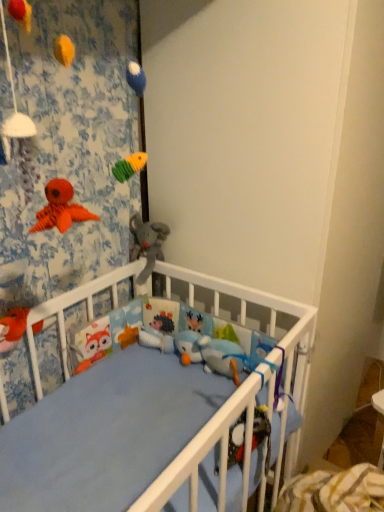
Question: Does soft plush elephant at center, the 2th toy when ordered from left to right, appear on the right side of white matte wall at upper center?

Choices:
 (A) no
 (B) yes

Answer: (A)

Question: Is soft plush elephant at center, the 2th toy from the right, thinner than white matte wall at upper center?

Choices:
 (A) no
 (B) yes

Answer: (B)

Question: Does soft plush elephant at center, the 2th toy from the right, have a greater width compared to white matte wall at upper center?

Choices:
 (A) no
 (B) yes

Answer: (A)

Question: Are soft plush elephant at center, the 2th toy when ordered from left to right, and white matte wall at upper center far apart?

Choices:
 (A) no
 (B) yes

Answer: (A)

Question: Can you confirm if soft plush elephant at center, the 2th toy from the right, is taller than white matte wall at upper center?

Choices:
 (A) yes
 (B) no

Answer: (B)

Question: Considering the relative sizes of soft plush elephant at center, the 2th toy from the right, and white matte wall at upper center in the image provided, is soft plush elephant at center, the 2th toy from the right, shorter than white matte wall at upper center?

Choices:
 (A) no
 (B) yes

Answer: (B)

Question: Are white matte wall at upper center and fluffy orange fox at lower left, positioned as the 1th toy in front-to-back order, located far from each other?

Choices:
 (A) no
 (B) yes

Answer: (A)

Question: From the image's perspective, does white matte wall at upper center appear higher than fluffy orange fox at lower left, acting as the 2th toy starting from the bottom?

Choices:
 (A) yes
 (B) no

Answer: (A)

Question: Does white matte wall at upper center turn towards fluffy orange fox at lower left, positioned as the 1th toy in front-to-back order?

Choices:
 (A) yes
 (B) no

Answer: (B)

Question: Is white matte wall at upper center thinner than fluffy orange fox at lower left, acting as the 3th toy starting from the right?

Choices:
 (A) yes
 (B) no

Answer: (B)

Question: Considering the relative sizes of white matte wall at upper center and fluffy orange fox at lower left, acting as the 3th toy starting from the right, in the image provided, is white matte wall at upper center shorter than fluffy orange fox at lower left, acting as the 3th toy starting from the right,?

Choices:
 (A) no
 (B) yes

Answer: (A)

Question: Is white matte wall at upper center smaller than fluffy orange fox at lower left, which is the second toy in top-to-bottom order?

Choices:
 (A) no
 (B) yes

Answer: (A)

Question: Is soft plush elephant at center, which is counted as the second toy, starting from the back, positioned with its back to fluffy orange fox at lower left, which is the second toy in top-to-bottom order?

Choices:
 (A) no
 (B) yes

Answer: (A)